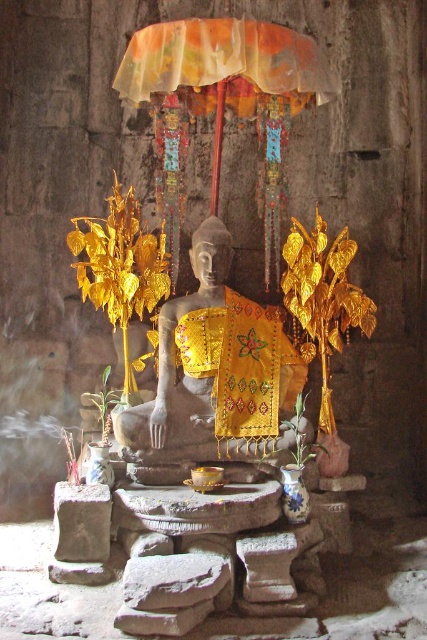
At what (x,y) coordinates should I click in order to perform the action: click on yellow embroidered cloth at center. Please return your answer as a coordinate pair (x, y). Image resolution: width=427 pixels, height=640 pixels. Looking at the image, I should click on (215, 371).

Is yellow embroidered cloth at center taller than translucent fabric umbrella at upper center?

Correct, yellow embroidered cloth at center is much taller as translucent fabric umbrella at upper center.

Is point (192, 356) behind point (136, 80)?

Yes, it is.

The image size is (427, 640). What are the coordinates of `yellow embroidered cloth at center` in the screenshot? It's located at (215, 371).